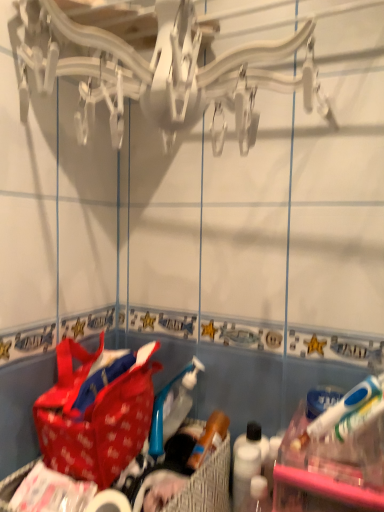
At what (x,y) coordinates should I click in order to perform the action: click on empty space that is ontop of red fabric picnic basket at lower center (from a real-world perspective). Please return your answer as a coordinate pair (x, y). Image resolution: width=384 pixels, height=512 pixels. Looking at the image, I should click on (118, 462).